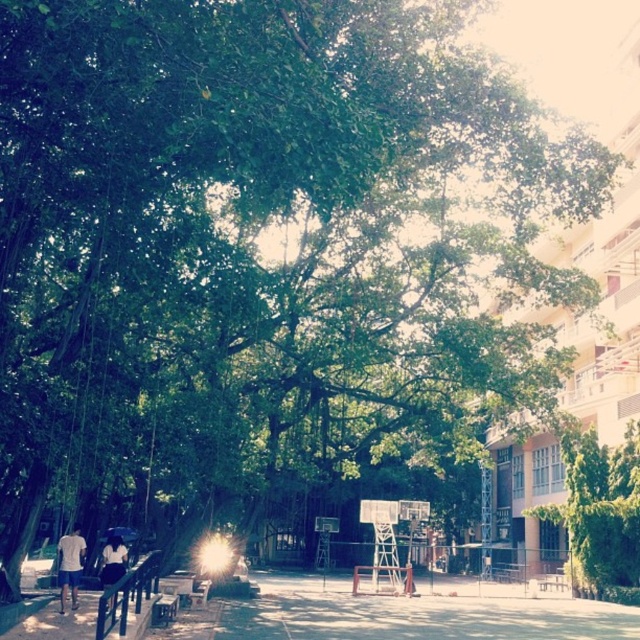
Question: Considering the relative positions of wooden park bench at lower center and blue fabric umbrella at lower left in the image provided, where is wooden park bench at lower center located with respect to blue fabric umbrella at lower left?

Choices:
 (A) left
 (B) right

Answer: (B)

Question: Does light blue t-shirt at lower left appear on the left side of wooden park bench at lower center?

Choices:
 (A) yes
 (B) no

Answer: (A)

Question: Which object is positioned farthest from the metallic silver basketball hoop at center?

Choices:
 (A) white cotton shirt at lower left
 (B) blue fabric umbrella at lower left
 (C) wooden park bench at lower center
 (D) wooden park bench at center

Answer: (A)

Question: Does green leafy tree at center come behind light blue t-shirt at lower left?

Choices:
 (A) no
 (B) yes

Answer: (B)

Question: Which point is farther to the camera?

Choices:
 (A) (208, 596)
 (B) (61, 589)
 (C) (164, 620)

Answer: (A)

Question: Among these objects, which one is nearest to the camera?

Choices:
 (A) metallic silver basketball hoop at center
 (B) green leafy tree at center
 (C) white cotton shirt at lower left

Answer: (C)